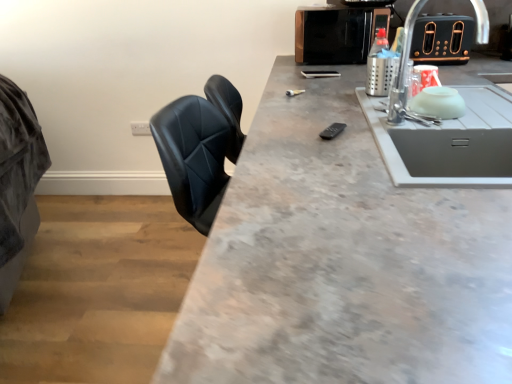
This screenshot has width=512, height=384. In order to click on free space in front of metallic silver bottle at upper right in this screenshot , I will do `click(376, 104)`.